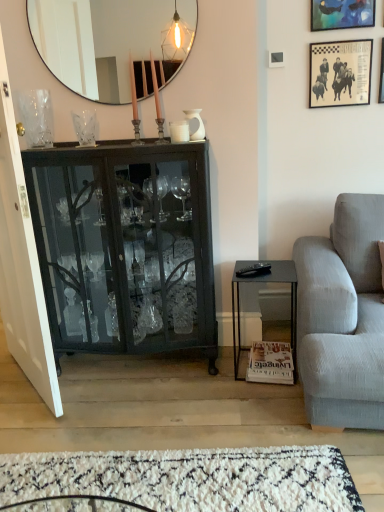
Find the location of a particular element. The height and width of the screenshot is (512, 384). unoccupied area behind white shag rug at lower center is located at coordinates (165, 406).